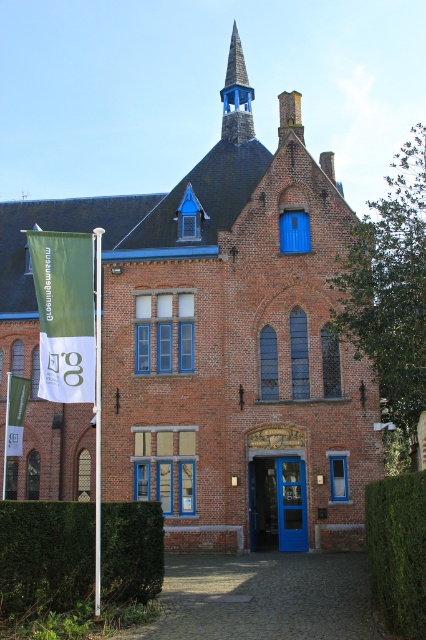
Question: Which of the following is the farthest from the observer?

Choices:
 (A) (399, 492)
 (B) (233, 28)

Answer: (B)

Question: Is green leafy hedge at lower right to the right of blue wooden spire at upper center from the viewer's perspective?

Choices:
 (A) no
 (B) yes

Answer: (B)

Question: Which object is closer to the camera taking this photo?

Choices:
 (A) green leafy hedge at lower left
 (B) green leafy hedge at lower right
 (C) green fabric flag at left

Answer: (B)

Question: Can you confirm if green fabric banner at left is thinner than blue wooden spire at upper center?

Choices:
 (A) no
 (B) yes

Answer: (A)

Question: Which of the following is the closest to the observer?

Choices:
 (A) green fabric flag at left
 (B) green fabric banner at left

Answer: (B)

Question: Does blue glass door at center lie in front of green fabric flag at left?

Choices:
 (A) yes
 (B) no

Answer: (A)